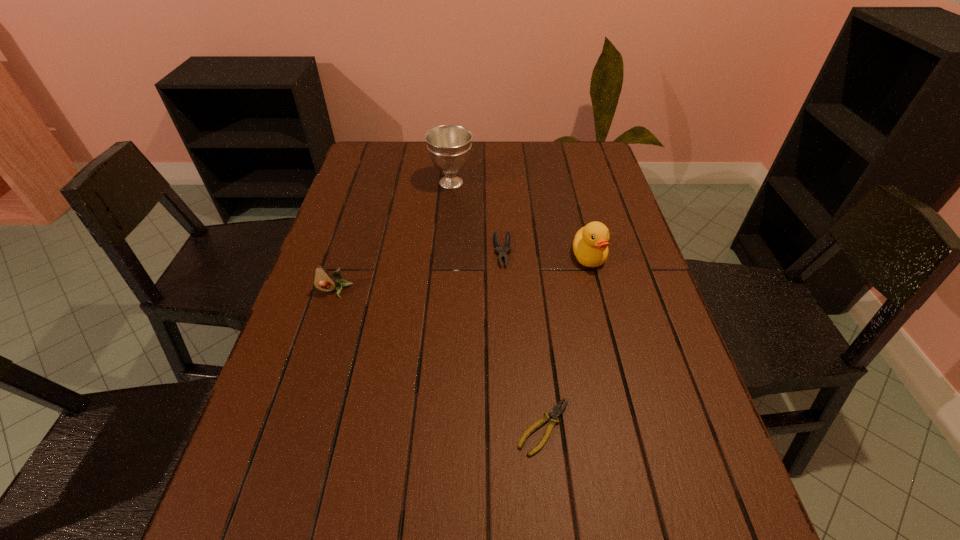
The image size is (960, 540). Identify the location of blank space at the far left corner of the desktop. (368, 164).

In the image, there is a desktop. Identify the location of vacant area at the far right corner. The width and height of the screenshot is (960, 540). (565, 155).

Identify the location of unoccupied position between the rightmost object and the avocado. The width and height of the screenshot is (960, 540). (462, 274).

Find the location of a particular element. The height and width of the screenshot is (540, 960). free spot between the duck and the fourth farthest object is located at coordinates (462, 274).

At what (x,y) coordinates should I click in order to perform the action: click on free space between the taller pliers and the chalice. Please return your answer as a coordinate pair (x, y). The image size is (960, 540). Looking at the image, I should click on (477, 217).

What are the coordinates of `vacant area that lies between the second tallest object and the fourth tallest object` in the screenshot? It's located at (545, 254).

Where is `empty space between the shorter pliers and the avocado`? This screenshot has width=960, height=540. empty space between the shorter pliers and the avocado is located at coordinates (440, 359).

In order to click on free space between the avocado and the farther pliers in this screenshot , I will do `click(419, 271)`.

Where is `free space between the fourth shortest object and the fourth farthest object`? The height and width of the screenshot is (540, 960). free space between the fourth shortest object and the fourth farthest object is located at coordinates (462, 274).

Where is `free point between the farther pliers and the third tallest object`? free point between the farther pliers and the third tallest object is located at coordinates (419, 271).